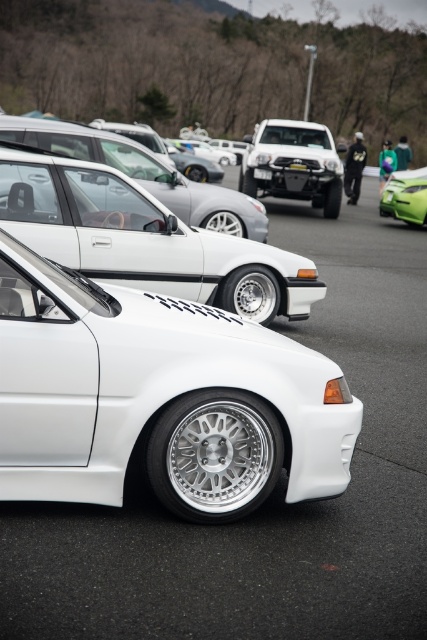
Question: Which is farther from the black plastic license plate at center?

Choices:
 (A) matte black truck at center
 (B) white matte sedan at center

Answer: (B)

Question: Which point is farther to the camera?

Choices:
 (A) white matte sedan at center
 (B) matte black truck at center

Answer: (B)

Question: Is green matte sports car at right wider than white plastic license plate at center?

Choices:
 (A) yes
 (B) no

Answer: (A)

Question: Among these objects, which one is farthest from the camera?

Choices:
 (A) green matte sports car at right
 (B) white matte sedan at center

Answer: (A)

Question: Does satin silver car at center appear on the right side of black plastic license plate at center?

Choices:
 (A) yes
 (B) no

Answer: (B)

Question: Can you confirm if matte black truck at center is smaller than green matte sports car at right?

Choices:
 (A) no
 (B) yes

Answer: (A)